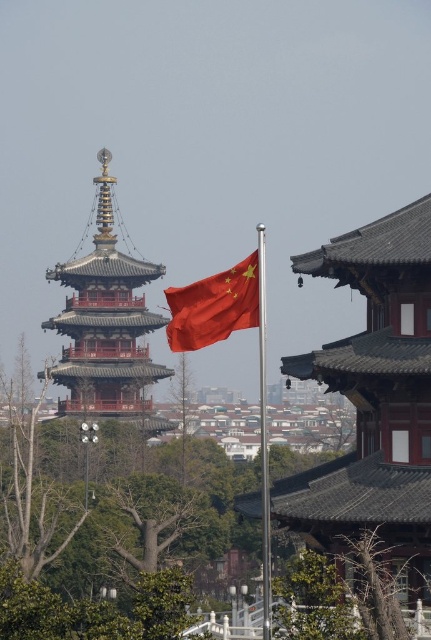
Question: Which point is closer to the camera?

Choices:
 (A) red lacquered pagoda at center
 (B) metallic flag pole at center
 (C) red fabric flag at center
 (D) green leafy tree at center

Answer: (C)

Question: Among these points, which one is farthest from the camera?

Choices:
 (A) (264, 241)
 (B) (156, 317)

Answer: (B)

Question: From the image, what is the correct spatial relationship of green leafy tree at center in relation to red lacquered pagoda at center?

Choices:
 (A) above
 (B) below

Answer: (B)

Question: Is red lacquered pagoda at center wider than metallic flag pole at center?

Choices:
 (A) no
 (B) yes

Answer: (B)

Question: Which point appears farthest from the camera in this image?

Choices:
 (A) (265, 445)
 (B) (250, 268)

Answer: (B)

Question: Does red lacquered pagoda at center appear over red fabric flag at center?

Choices:
 (A) no
 (B) yes

Answer: (B)